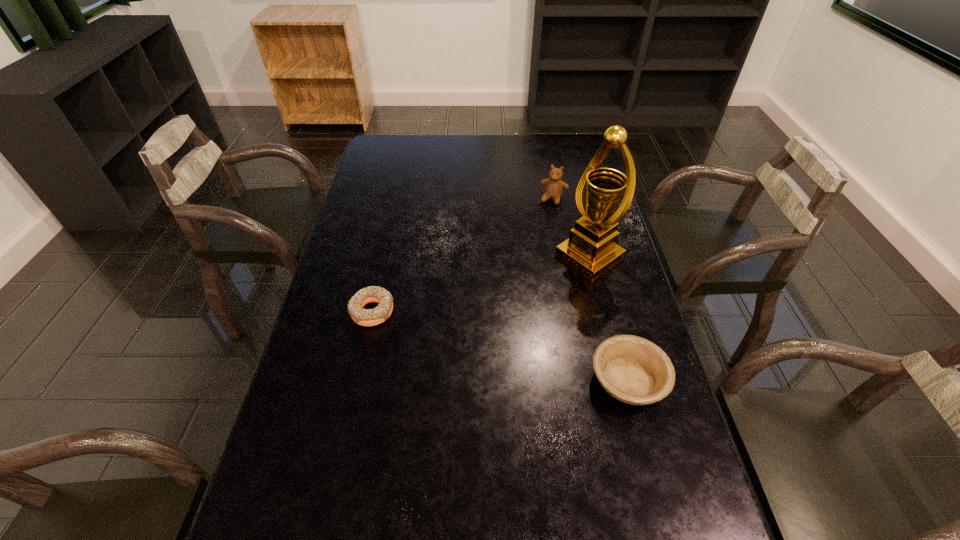
Locate an element on the screen. The height and width of the screenshot is (540, 960). vacant spot on the desktop that is between the doughnut and the bowl and is positioned on the front-facing side of the teddy bear is located at coordinates (494, 344).

At what (x,y) coordinates should I click in order to perform the action: click on vacant space on the desktop that is between the doughnut and the nearest object and is positioned on the front-facing side of the tallest object. Please return your answer as a coordinate pair (x, y). Looking at the image, I should click on pos(470,338).